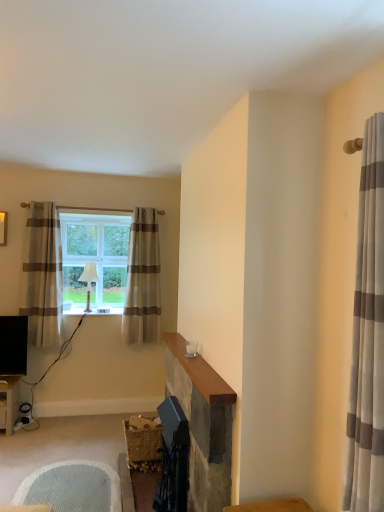
Question: Looking at their shapes, would you say white fabric lampshade at window is wider or thinner than white textured rug at lower left?

Choices:
 (A) thin
 (B) wide

Answer: (A)

Question: Choose the correct answer: Is white fabric lampshade at window inside white textured rug at lower left or outside it?

Choices:
 (A) inside
 (B) outside

Answer: (B)

Question: Considering the real-world distances, which object is closest to the beige striped curtain at left, the 1th curtain from the left?

Choices:
 (A) beige striped curtain at center, the second curtain positioned from the left
 (B) clear glass window at center
 (C) white textured rug at lower left
 (D) white fabric lampshade at window
 (E) gray striped fabric curtain at right, the third curtain positioned from the back

Answer: (B)

Question: Estimate the real-world distances between objects in this image. Which object is farther from the white fabric lampshade at window?

Choices:
 (A) smooth stone fireplace at center
 (B) beige striped curtain at left, marked as the third curtain in a right-to-left arrangement
 (C) clear glass window at center
 (D) white textured rug at lower left
 (E) beige striped curtain at center, positioned as the 2th curtain in right-to-left order

Answer: (A)